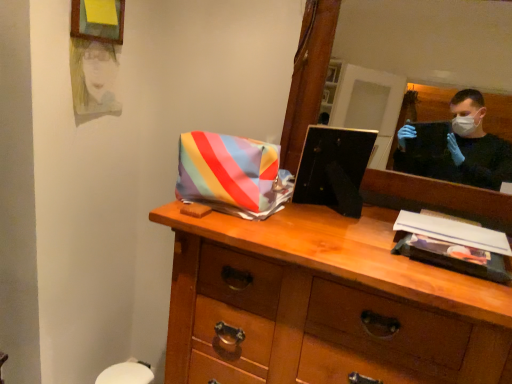
Question: Does wooden mirror at upper right come behind matte yellow picture frame at upper left?

Choices:
 (A) no
 (B) yes

Answer: (A)

Question: From a real-world perspective, is wooden mirror at upper right over matte yellow picture frame at upper left?

Choices:
 (A) yes
 (B) no

Answer: (B)

Question: Can you confirm if wooden mirror at upper right is smaller than matte yellow picture frame at upper left?

Choices:
 (A) yes
 (B) no

Answer: (B)

Question: Is wooden mirror at upper right facing towards matte yellow picture frame at upper left?

Choices:
 (A) yes
 (B) no

Answer: (B)

Question: Does wooden mirror at upper right have a larger size compared to matte yellow picture frame at upper left?

Choices:
 (A) yes
 (B) no

Answer: (A)

Question: From the image's perspective, is wooden mirror at upper right beneath matte yellow picture frame at upper left?

Choices:
 (A) yes
 (B) no

Answer: (A)

Question: Can you confirm if wooden chest of drawers at center is shorter than matte yellow picture frame at upper left?

Choices:
 (A) yes
 (B) no

Answer: (B)

Question: From a real-world perspective, is wooden chest of drawers at center beneath matte yellow picture frame at upper left?

Choices:
 (A) yes
 (B) no

Answer: (A)

Question: Is wooden chest of drawers at center not near matte yellow picture frame at upper left?

Choices:
 (A) yes
 (B) no

Answer: (B)

Question: Is wooden chest of drawers at center to the left of matte yellow picture frame at upper left from the viewer's perspective?

Choices:
 (A) yes
 (B) no

Answer: (B)

Question: Does wooden chest of drawers at center have a lesser width compared to matte yellow picture frame at upper left?

Choices:
 (A) yes
 (B) no

Answer: (B)

Question: Would you say wooden chest of drawers at center contains matte yellow picture frame at upper left?

Choices:
 (A) no
 (B) yes

Answer: (A)

Question: Does wooden chest of drawers at center lie behind wooden mirror at upper right?

Choices:
 (A) yes
 (B) no

Answer: (B)